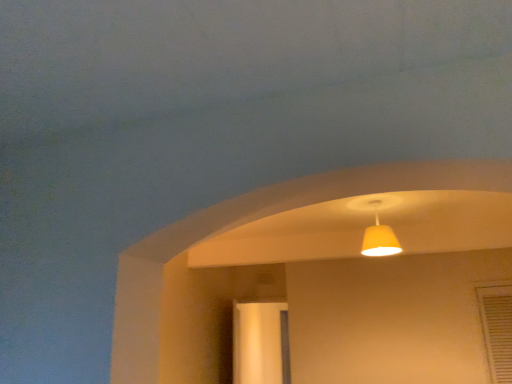
Locate an element on the screen. clear glass screen door at center is located at coordinates (257, 342).

What do you see at coordinates (257, 342) in the screenshot?
I see `clear glass screen door at center` at bounding box center [257, 342].

What do you see at coordinates (379, 236) in the screenshot? I see `matte yellow lampshade at upper center` at bounding box center [379, 236].

What are the coordinates of `matte yellow lampshade at upper center` in the screenshot? It's located at (379, 236).

The height and width of the screenshot is (384, 512). What are the coordinates of `clear glass screen door at center` in the screenshot? It's located at (257, 342).

Does clear glass screen door at center appear on the right side of matte yellow lampshade at upper center?

No, clear glass screen door at center is not to the right of matte yellow lampshade at upper center.

Who is more distant, clear glass screen door at center or matte yellow lampshade at upper center?

clear glass screen door at center is further away from the camera.

Is point (281, 344) closer or farther from the camera than point (381, 240)?

Clearly, point (281, 344) is more distant from the camera than point (381, 240).

From the image's perspective, is clear glass screen door at center located above or below matte yellow lampshade at upper center?

clear glass screen door at center is below matte yellow lampshade at upper center.

From a real-world perspective, is clear glass screen door at center on matte yellow lampshade at upper center?

Actually, clear glass screen door at center is physically below matte yellow lampshade at upper center in the real world.

Can you confirm if clear glass screen door at center is thinner than matte yellow lampshade at upper center?

Yes.

Who is taller, clear glass screen door at center or matte yellow lampshade at upper center?

With more height is clear glass screen door at center.

Between clear glass screen door at center and matte yellow lampshade at upper center, which one has larger size?

clear glass screen door at center is bigger.

Is clear glass screen door at center not inside matte yellow lampshade at upper center?

That's correct, clear glass screen door at center is outside of matte yellow lampshade at upper center.

Does clear glass screen door at center touch matte yellow lampshade at upper center?

clear glass screen door at center and matte yellow lampshade at upper center are clearly separated.

Is clear glass screen door at center facing away from matte yellow lampshade at upper center?

clear glass screen door at center does not have its back to matte yellow lampshade at upper center.

The image size is (512, 384). What are the coordinates of `lamp lying above the clear glass screen door at center (from the image's perspective)` in the screenshot? It's located at (379, 236).

Which is more to the right, matte yellow lampshade at upper center or clear glass screen door at center?

matte yellow lampshade at upper center is more to the right.

Between matte yellow lampshade at upper center and clear glass screen door at center, which one is positioned behind?

Positioned behind is clear glass screen door at center.

Which is closer to the camera, (389, 249) or (251, 350)?

The point (389, 249) is more forward.

From the image's perspective, is matte yellow lampshade at upper center positioned above or below clear glass screen door at center?

Clearly, from the image's perspective, matte yellow lampshade at upper center is above clear glass screen door at center.

From a real-world perspective, is matte yellow lampshade at upper center located higher than clear glass screen door at center?

Yes.

Considering the sizes of matte yellow lampshade at upper center and clear glass screen door at center in the image, is matte yellow lampshade at upper center wider or thinner than clear glass screen door at center?

Considering their sizes, matte yellow lampshade at upper center looks broader than clear glass screen door at center.

Between matte yellow lampshade at upper center and clear glass screen door at center, which one has less height?

Standing shorter between the two is matte yellow lampshade at upper center.

Considering the relative sizes of matte yellow lampshade at upper center and clear glass screen door at center in the image provided, is matte yellow lampshade at upper center smaller than clear glass screen door at center?

Yes, matte yellow lampshade at upper center is smaller than clear glass screen door at center.

Is matte yellow lampshade at upper center completely or partially outside of clear glass screen door at center?

Indeed, matte yellow lampshade at upper center is completely outside clear glass screen door at center.

Is matte yellow lampshade at upper center not close to clear glass screen door at center?

Yes, matte yellow lampshade at upper center and clear glass screen door at center are located far from each other.

Is matte yellow lampshade at upper center aimed at clear glass screen door at center?

No, matte yellow lampshade at upper center is not turned towards clear glass screen door at center.

What are the coordinates of `lamp above the clear glass screen door at center (from the image's perspective)` in the screenshot? It's located at (379, 236).

I want to click on screen door lying on the left of matte yellow lampshade at upper center, so click(257, 342).

Locate an element on the screen. screen door below the matte yellow lampshade at upper center (from a real-world perspective) is located at coordinates (257, 342).